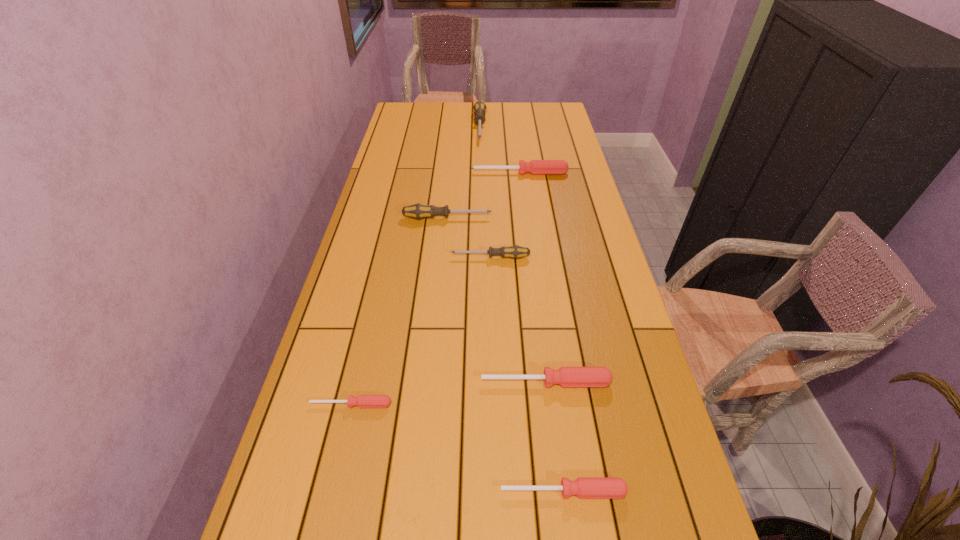
The height and width of the screenshot is (540, 960). I want to click on empty space between the biggest gray screwdriver and the nearest red screwdriver, so click(x=521, y=309).

What are the coordinates of `empty location between the nearest screwdriver and the biggest red screwdriver` in the screenshot? It's located at (541, 332).

The height and width of the screenshot is (540, 960). I want to click on free space between the second farthest object and the smallest gray screwdriver, so click(505, 215).

Where is `free space between the sixth tallest screwdriver and the farthest red screwdriver`? The width and height of the screenshot is (960, 540). free space between the sixth tallest screwdriver and the farthest red screwdriver is located at coordinates (541, 332).

Where is `object that is the fifth nearest to the second shortest object`? The width and height of the screenshot is (960, 540). object that is the fifth nearest to the second shortest object is located at coordinates (535, 167).

You are a GUI agent. You are given a task and a screenshot of the screen. Output one action in this format:
    pyautogui.click(x=<x>, y=<y>)
    Task: Click on the object that stands as the closest to the biggest gray screwdriver
    The width and height of the screenshot is (960, 540).
    Given the screenshot: What is the action you would take?
    pyautogui.click(x=535, y=167)

Locate an element on the screen. The height and width of the screenshot is (540, 960). the second closest screwdriver to the second shortest object is located at coordinates (362, 401).

Where is `the fourth closest screwdriver relative to the biggest gray screwdriver`? The height and width of the screenshot is (540, 960). the fourth closest screwdriver relative to the biggest gray screwdriver is located at coordinates (566, 376).

I want to click on the closest gray screwdriver to the sixth nearest screwdriver, so click(x=479, y=108).

I want to click on gray screwdriver that stands as the second closest to the third nearest screwdriver, so click(417, 211).